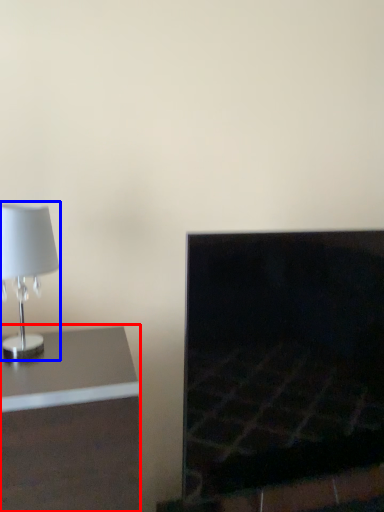
Question: Among these objects, which one is farthest to the camera, furniture (highlighted by a red box) or lamp (highlighted by a blue box)?

Choices:
 (A) furniture
 (B) lamp

Answer: (B)